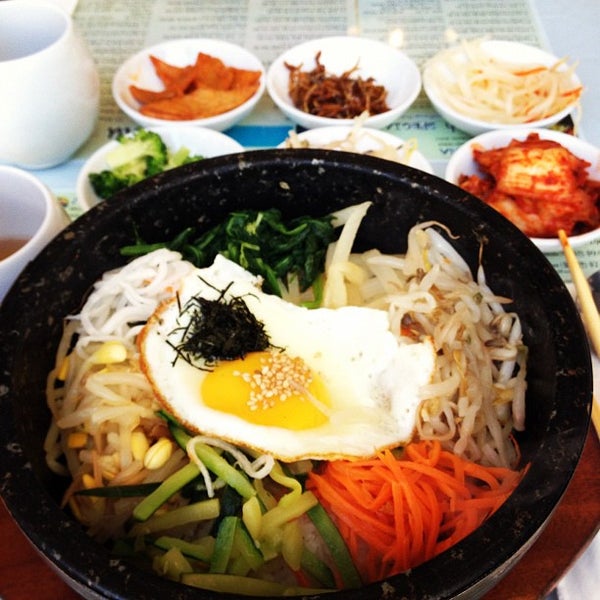
Locate an element on the screen. table is located at coordinates (555, 543), (39, 576).